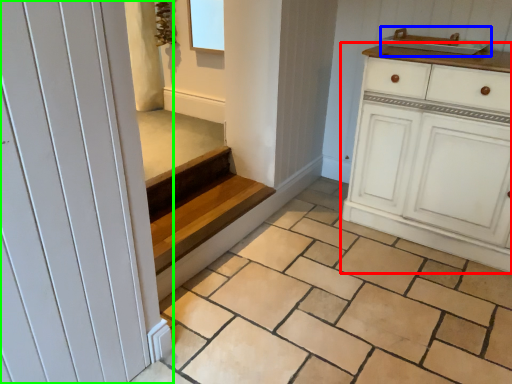
Question: Which is farther away from chest of drawers (highlighted by a red box)? sink (highlighted by a blue box) or door (highlighted by a green box)?

Choices:
 (A) sink
 (B) door

Answer: (B)